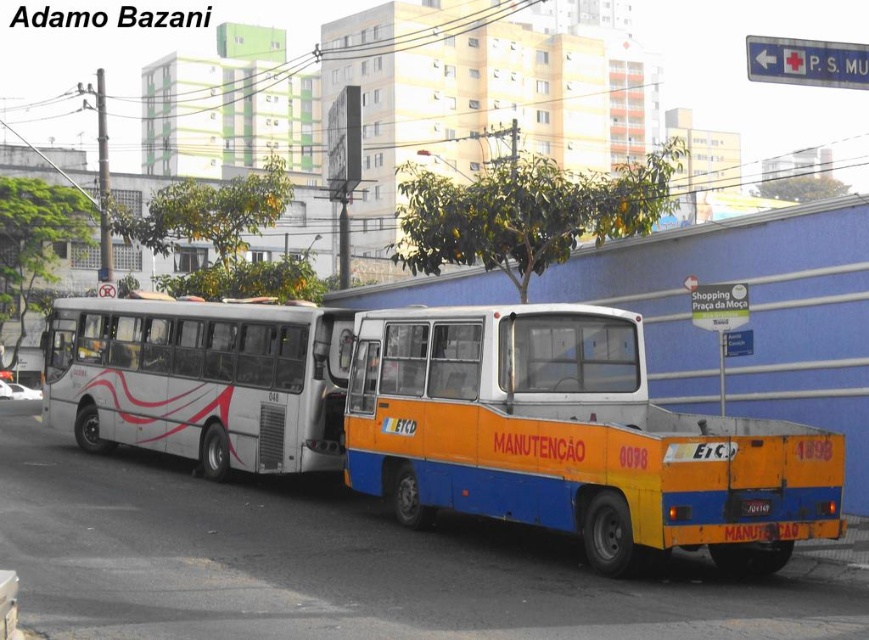
Question: Estimate the real-world distances between objects in this image. Which object is closer to the black plastic license plate at center?

Choices:
 (A) white glossy bus at center
 (B) yellow matte bus at center

Answer: (B)

Question: Does yellow matte bus at center come in front of black plastic license plate at center?

Choices:
 (A) no
 (B) yes

Answer: (A)

Question: Where is yellow matte bus at center located in relation to white glossy bus at center in the image?

Choices:
 (A) left
 (B) right

Answer: (B)

Question: Which point is closer to the camera?

Choices:
 (A) (737, 467)
 (B) (766, 502)
 (C) (136, 435)

Answer: (A)

Question: Which point is closer to the camera taking this photo?

Choices:
 (A) (489, 508)
 (B) (63, 396)

Answer: (A)

Question: Does white glossy bus at center have a smaller size compared to black plastic license plate at center?

Choices:
 (A) no
 (B) yes

Answer: (A)